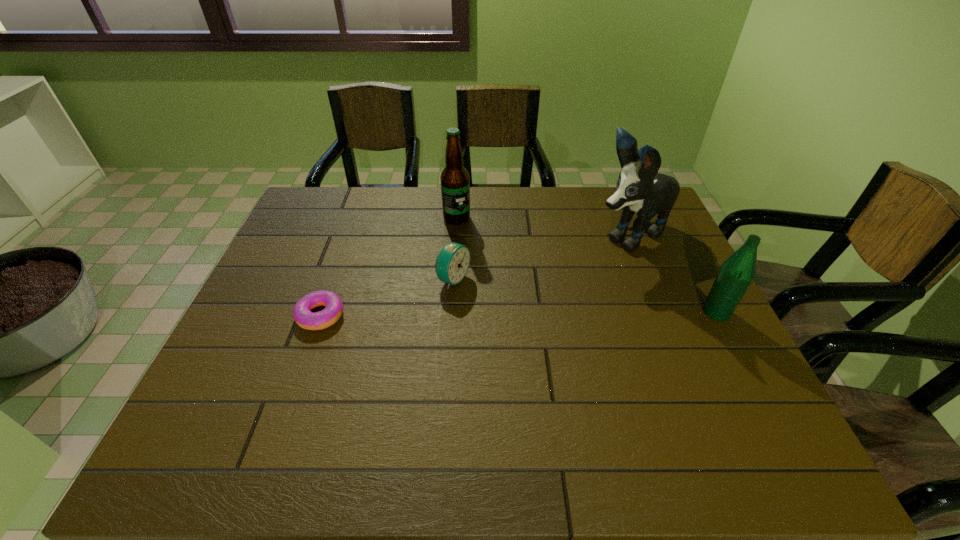
Locate an element on the screen. free space on the desktop that is between the doughnut and the third tallest object and is positioned on the front-facing side of the alarm clock is located at coordinates (531, 314).

Image resolution: width=960 pixels, height=540 pixels. What are the coordinates of `free space on the desktop that is between the doughnut and the bottle and is positioned on the front-facing side of the tallest object` in the screenshot? It's located at 488,314.

At what (x,y) coordinates should I click in order to perform the action: click on vacant spot on the desktop that is between the leftmost object and the bottle and is positioned on the label of the second tallest object. Please return your answer as a coordinate pair (x, y). The height and width of the screenshot is (540, 960). Looking at the image, I should click on (489, 314).